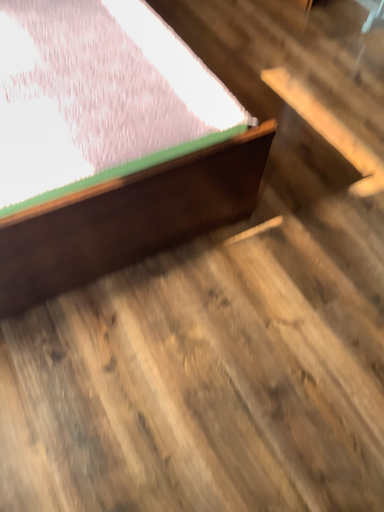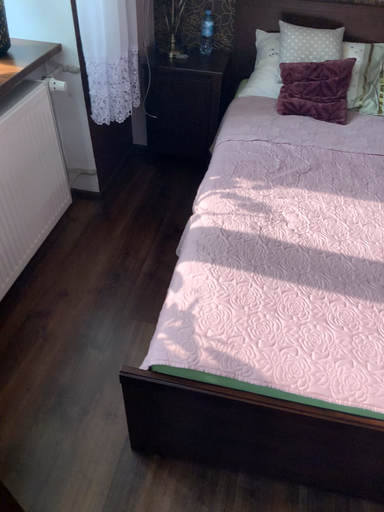
Question: Which way did the camera rotate in the video?

Choices:
 (A) rotated right
 (B) rotated left

Answer: (B)